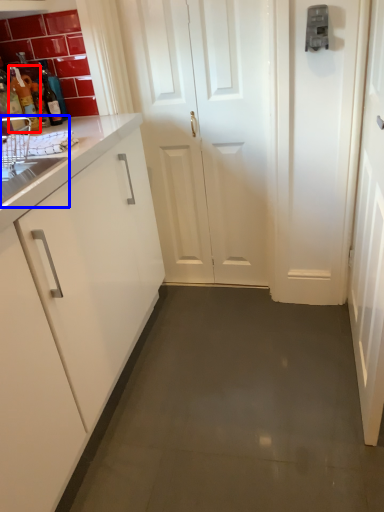
Question: Which of the following is the closest to the observer, bottle (highlighted by a red box) or sink (highlighted by a blue box)?

Choices:
 (A) bottle
 (B) sink

Answer: (B)